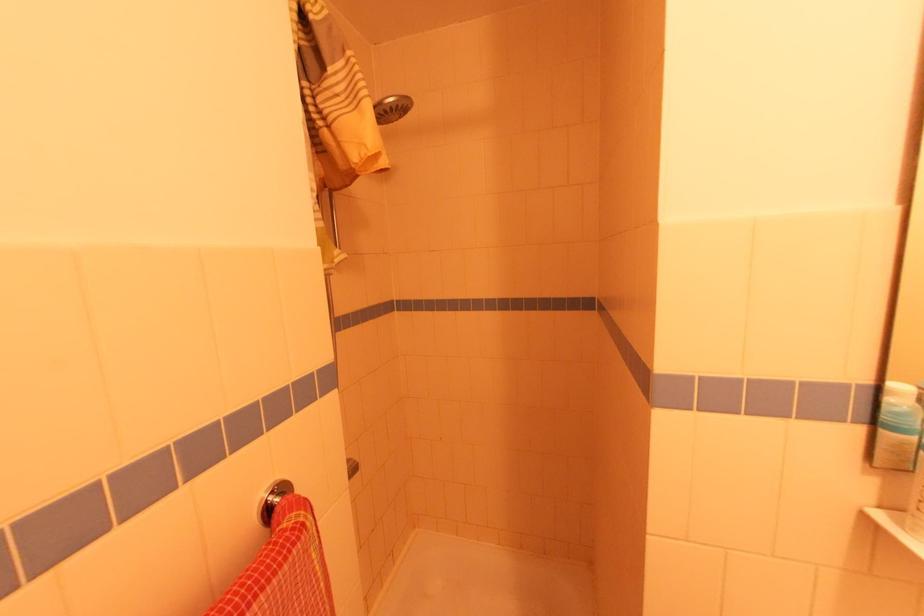
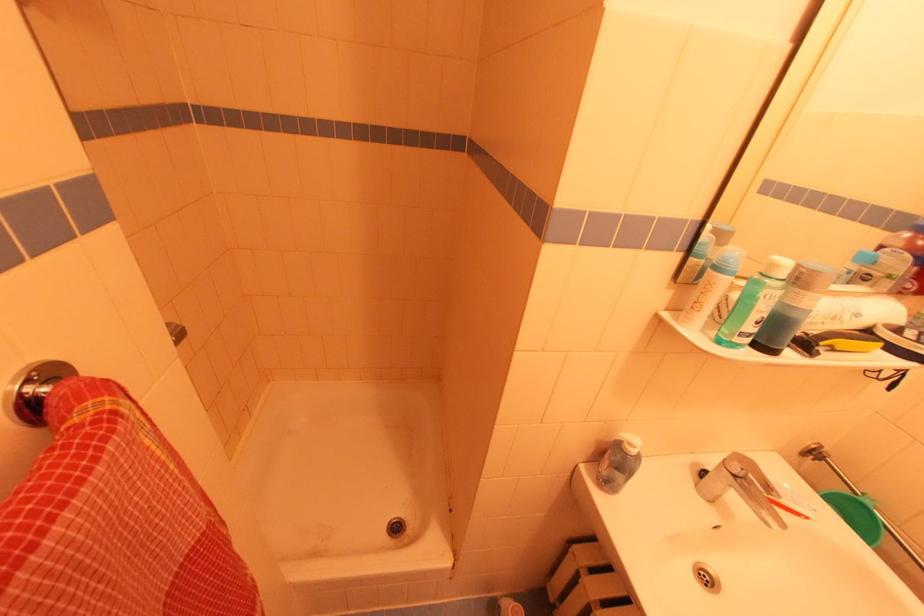
First-person continuous shooting, in which direction is the camera rotating?

The camera rotated toward right-down.